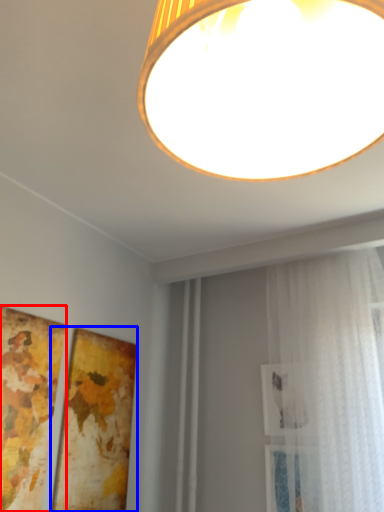
Question: Among these objects, which one is farthest to the camera, picture frame (highlighted by a red box) or picture frame (highlighted by a blue box)?

Choices:
 (A) picture frame
 (B) picture frame

Answer: (B)